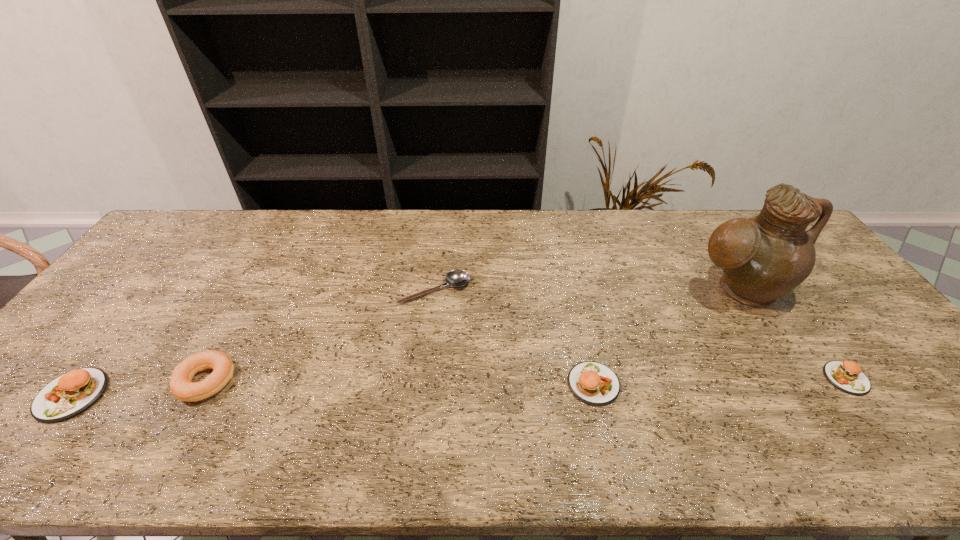
Please determine a free point for an extra patty_(food) to ensure balance. Please provide its 2D coordinates. Your answer should be formatted as a tuple, i.e. [(x, y)], where the tuple contains the x and y coordinates of a point satisfying the conditions above.

[(335, 389)]